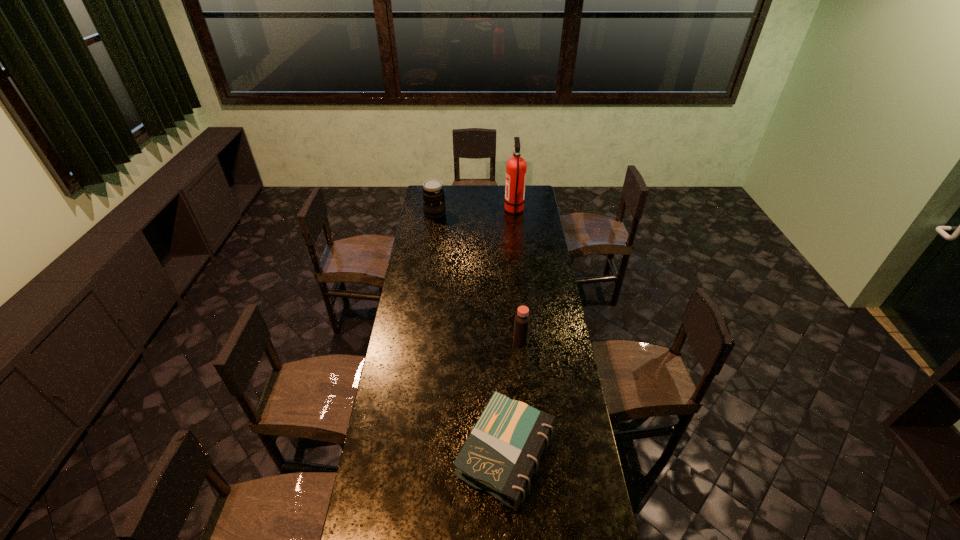
I want to click on unoccupied position between the third farthest object and the telephoto lens, so click(478, 277).

At what (x,y) coordinates should I click in order to perform the action: click on vacant space in between the vinegar and the paperback book. Please return your answer as a coordinate pair (x, y). The height and width of the screenshot is (540, 960). Looking at the image, I should click on (514, 397).

Image resolution: width=960 pixels, height=540 pixels. I want to click on vacant point located between the leftmost object and the vinegar, so click(x=478, y=277).

What are the coordinates of `free spot between the leftmost object and the fire extinguisher` in the screenshot? It's located at (474, 212).

Identify the location of unoccupied position between the telephoto lens and the tallest object. (474, 212).

You are a GUI agent. You are given a task and a screenshot of the screen. Output one action in this format:
    pyautogui.click(x=<x>, y=<y>)
    Task: Click on the free spot between the nearest object and the tallest object
    The height and width of the screenshot is (540, 960).
    Given the screenshot: What is the action you would take?
    pyautogui.click(x=510, y=333)

The width and height of the screenshot is (960, 540). Identify the location of object that is the second closest to the paperback book. (516, 166).

The width and height of the screenshot is (960, 540). I want to click on object that ranks as the second closest to the second nearest object, so click(x=516, y=166).

At what (x,y) coordinates should I click in order to perform the action: click on free space in the image that satisfies the following two spatial constraints: 1. on the handle side of the fire extinguisher; 2. on the front side of the second nearest object. Please return your answer as a coordinate pair (x, y). Looking at the image, I should click on (528, 341).

Image resolution: width=960 pixels, height=540 pixels. Identify the location of vacant region that satisfies the following two spatial constraints: 1. on the handle side of the tallest object; 2. on the front side of the telephoto lens. (515, 213).